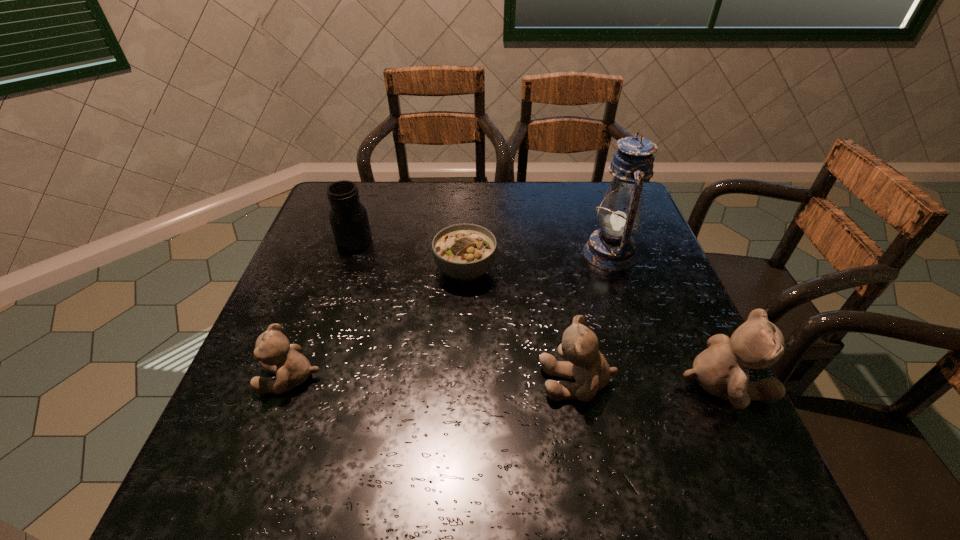
The height and width of the screenshot is (540, 960). Identify the location of vacant area situated on the face of the second teddy bear from left to right. (368, 381).

The height and width of the screenshot is (540, 960). What are the coordinates of `vacant point located 0.330m on the face of the second teddy bear from left to right` in the screenshot? It's located at (373, 381).

This screenshot has height=540, width=960. What are the coordinates of `vacant space positioned 0.340m on the back of the fourth object from right to left` in the screenshot? It's located at (468, 183).

Locate an element on the screen. Image resolution: width=960 pixels, height=540 pixels. vacant position located on the front-facing side of the tallest object is located at coordinates (431, 254).

Identify the location of free space located on the front-facing side of the tallest object. (522, 254).

Locate an element on the screen. Image resolution: width=960 pixels, height=540 pixels. vacant space located 0.340m on the front-facing side of the tallest object is located at coordinates (454, 254).

Locate an element on the screen. vacant space situated on the back of the jar is located at coordinates (364, 212).

Identify the location of teddy bear present at the left edge. (275, 354).

You are a GUI agent. You are given a task and a screenshot of the screen. Output one action in this format:
    pyautogui.click(x=<x>, y=<y>)
    Task: Click on the jar that is at the left edge
    This screenshot has width=960, height=540.
    Given the screenshot: What is the action you would take?
    [348, 217]

I want to click on teddy bear that is at the right edge, so click(722, 370).